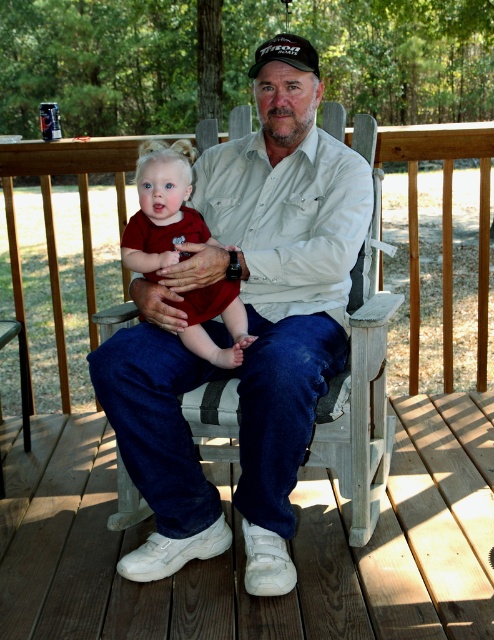
Question: Which point is closer to the camera taking this photo?

Choices:
 (A) (366, 182)
 (B) (128, 621)
 (C) (167, 157)
 (D) (276, 52)

Answer: (B)

Question: Which object is the farthest from the matte khaki shirt at center?

Choices:
 (A) black fabric baseball cap at center
 (B) white wood deck at lower center

Answer: (A)

Question: Can you confirm if matte khaki shirt at center is positioned to the right of matte red dress at center?

Choices:
 (A) no
 (B) yes

Answer: (B)

Question: Is white wood deck at lower center thinner than matte red dress at center?

Choices:
 (A) yes
 (B) no

Answer: (B)

Question: Does matte khaki shirt at center appear over matte red dress at center?

Choices:
 (A) yes
 (B) no

Answer: (B)

Question: Which object is the farthest from the black fabric baseball cap at center?

Choices:
 (A) matte red dress at center
 (B) white wood deck at lower center
 (C) matte khaki shirt at center

Answer: (B)